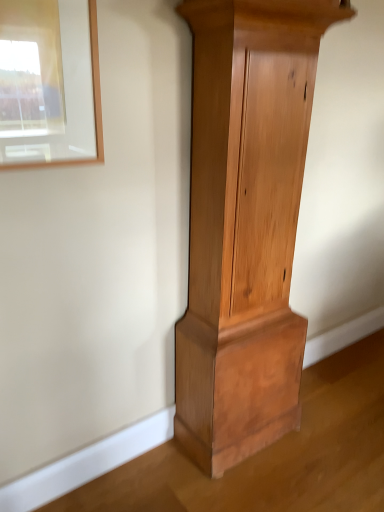
Locate an element on the screen. free space in front of natural wood cupboard at center is located at coordinates (260, 484).